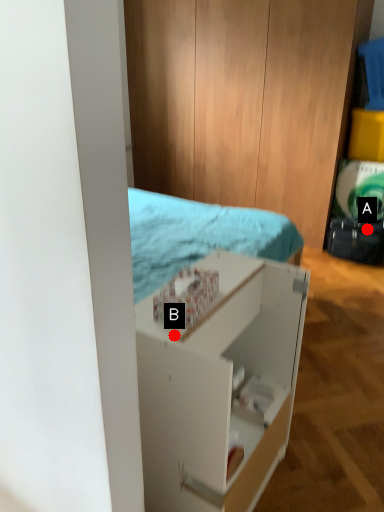
Question: Two points are circled on the image, labeled by A and B beside each circle. Which point is farther from the camera taking this photo?

Choices:
 (A) A is further
 (B) B is further

Answer: (A)